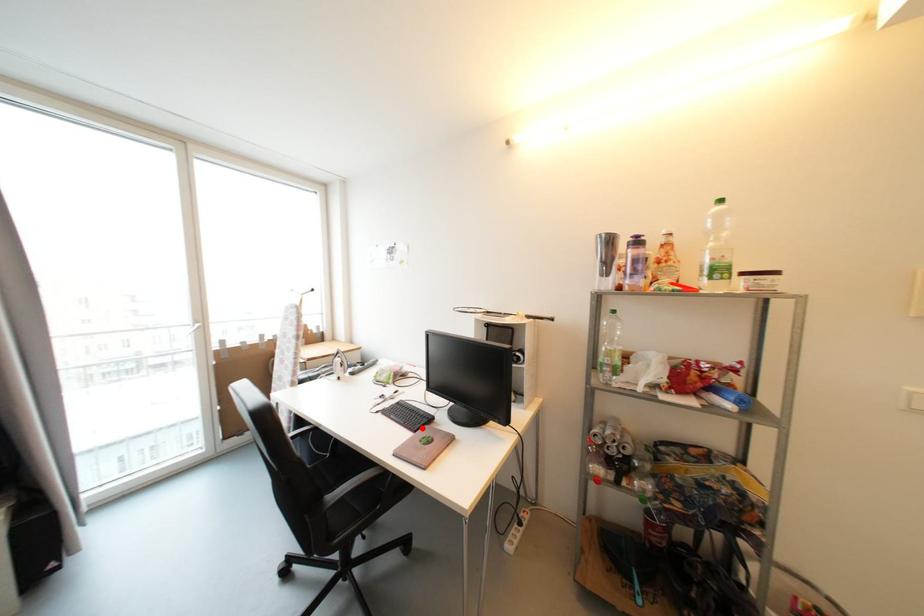
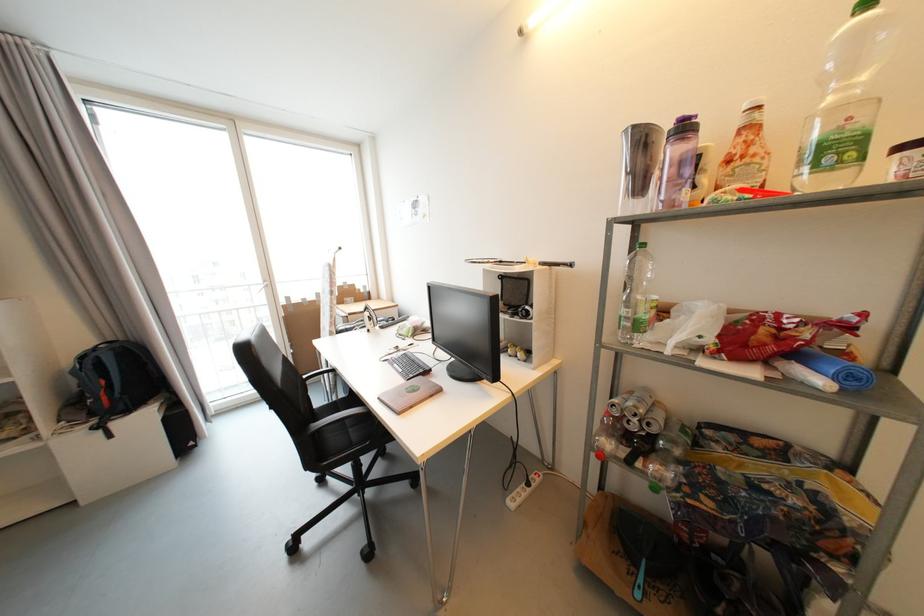
Where in the second image is the point corresponding to the highlighted location from the first image?

(417, 378)